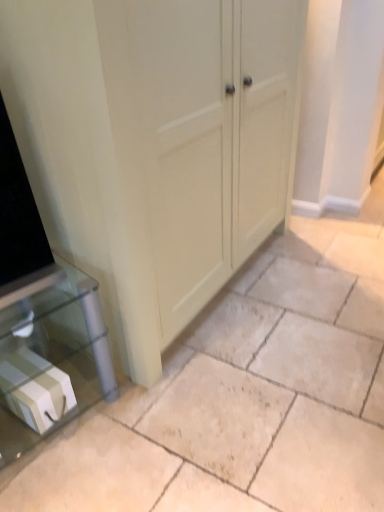
Image resolution: width=384 pixels, height=512 pixels. Find the location of `vacant area that lies to the right of matte cream cupboard at center`. vacant area that lies to the right of matte cream cupboard at center is located at coordinates (315, 272).